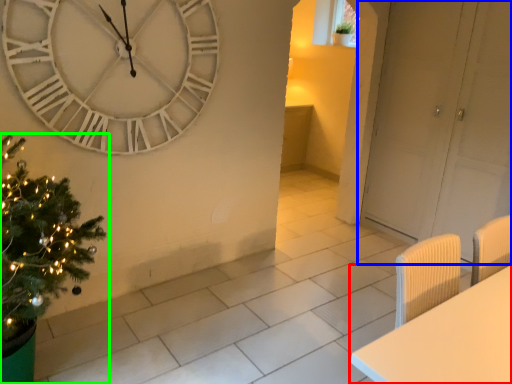
Question: Which object is the farthest from furniture (highlighted by a red box)? Choose among these: door (highlighted by a blue box) or christmas tree (highlighted by a green box).

Choices:
 (A) door
 (B) christmas tree

Answer: (A)